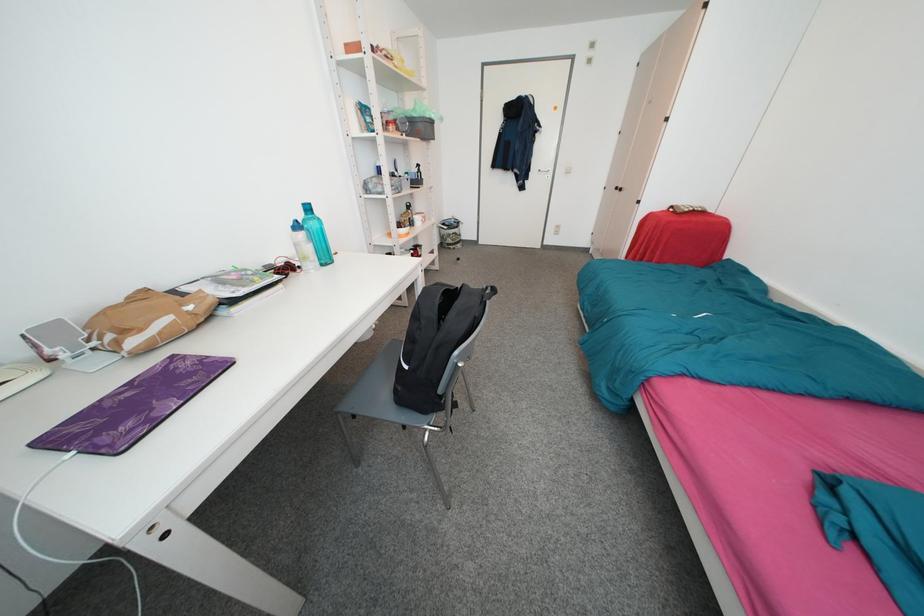
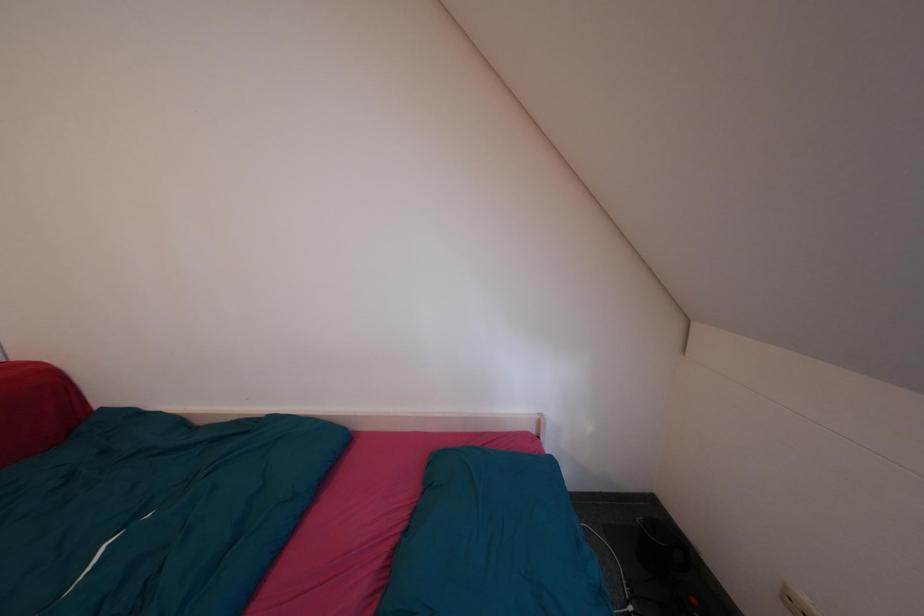
First-person continuous shooting, in which direction is the camera rotating?

The camera's rotation is toward right-down.